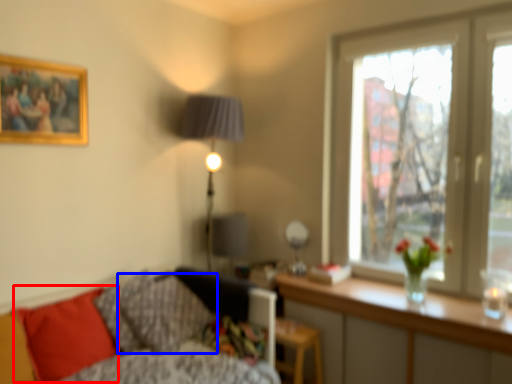
Question: Which object appears closest to the camera in this image, pillow (highlighted by a red box) or pillow (highlighted by a blue box)?

Choices:
 (A) pillow
 (B) pillow

Answer: (A)